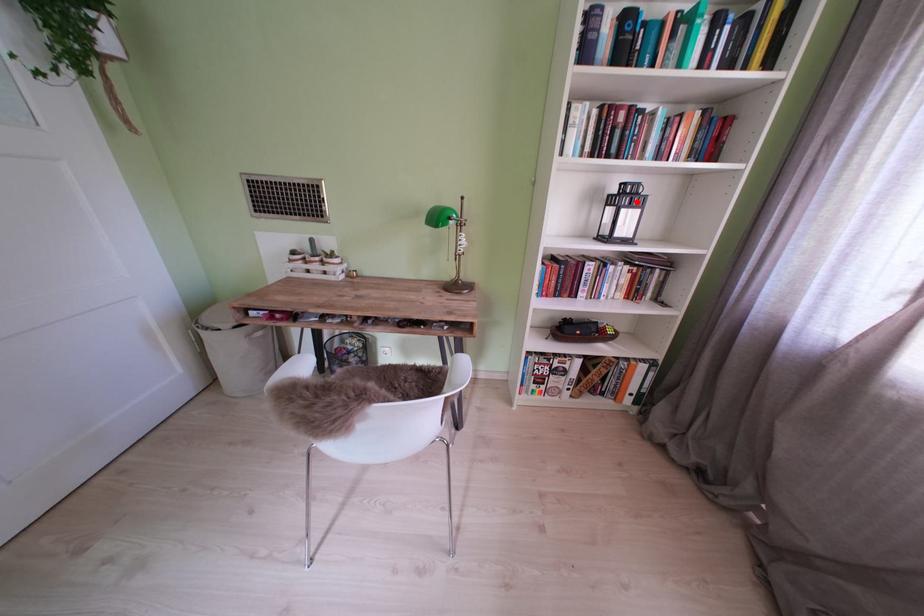
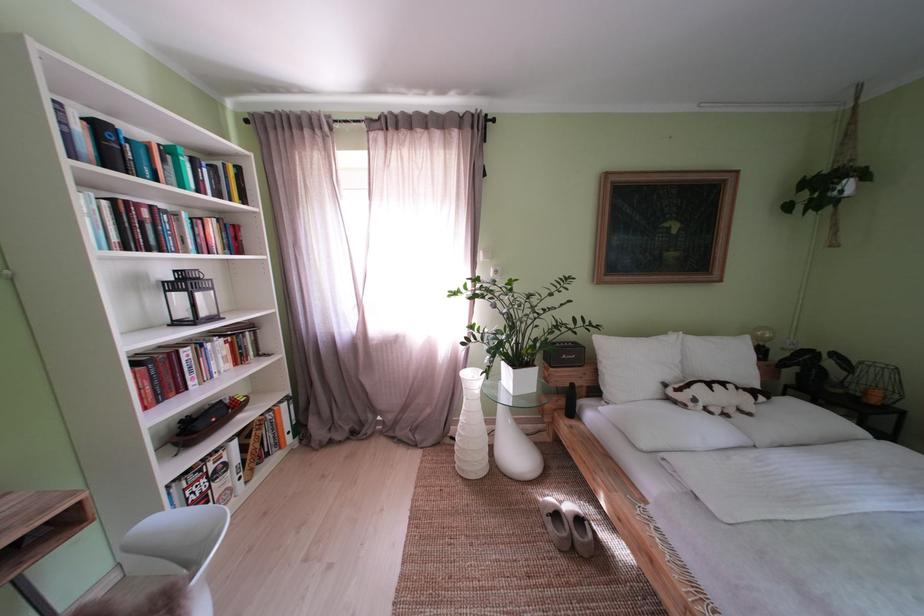
Where in the second image is the point corresponding to the highlighted location from the first image?

(198, 286)